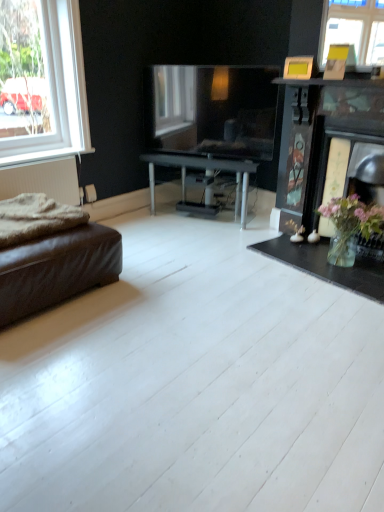
Question: Is beige woolen blanket at lower left directly adjacent to clear glass vase at lower right?

Choices:
 (A) no
 (B) yes

Answer: (A)

Question: Is beige woolen blanket at lower left shorter than clear glass vase at lower right?

Choices:
 (A) yes
 (B) no

Answer: (B)

Question: Considering the relative positions of beige woolen blanket at lower left and clear glass vase at lower right in the image provided, is beige woolen blanket at lower left behind clear glass vase at lower right?

Choices:
 (A) no
 (B) yes

Answer: (A)

Question: From a real-world perspective, is beige woolen blanket at lower left over clear glass vase at lower right?

Choices:
 (A) yes
 (B) no

Answer: (A)

Question: Does beige woolen blanket at lower left turn towards clear glass vase at lower right?

Choices:
 (A) no
 (B) yes

Answer: (A)

Question: Is beige woolen blanket at lower left outside clear glass vase at lower right?

Choices:
 (A) yes
 (B) no

Answer: (A)

Question: Is white plastic window at upper left completely or partially outside of brown leather studio couch at lower left?

Choices:
 (A) yes
 (B) no

Answer: (A)

Question: Is white plastic window at upper left oriented towards brown leather studio couch at lower left?

Choices:
 (A) yes
 (B) no

Answer: (B)

Question: Does white plastic window at upper left have a larger size compared to brown leather studio couch at lower left?

Choices:
 (A) yes
 (B) no

Answer: (B)

Question: Is white plastic window at upper left wider than brown leather studio couch at lower left?

Choices:
 (A) yes
 (B) no

Answer: (B)

Question: Is white plastic window at upper left to the left of brown leather studio couch at lower left from the viewer's perspective?

Choices:
 (A) yes
 (B) no

Answer: (A)

Question: Would you say brown leather studio couch at lower left is part of white plastic window at upper left's contents?

Choices:
 (A) yes
 (B) no

Answer: (B)

Question: Could you tell me if brown leather studio couch at lower left is turned towards white plastic window at upper left?

Choices:
 (A) yes
 (B) no

Answer: (B)